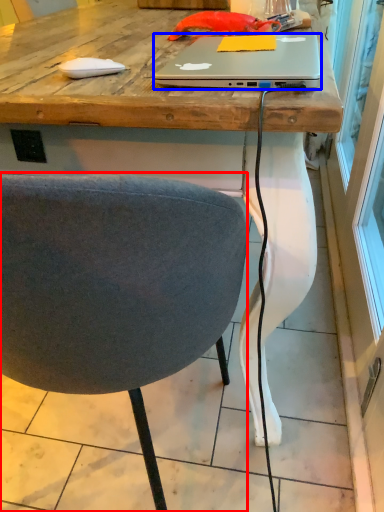
Question: Which of the following is the closest to the observer, chair (highlighted by a red box) or laptop (highlighted by a blue box)?

Choices:
 (A) chair
 (B) laptop

Answer: (A)